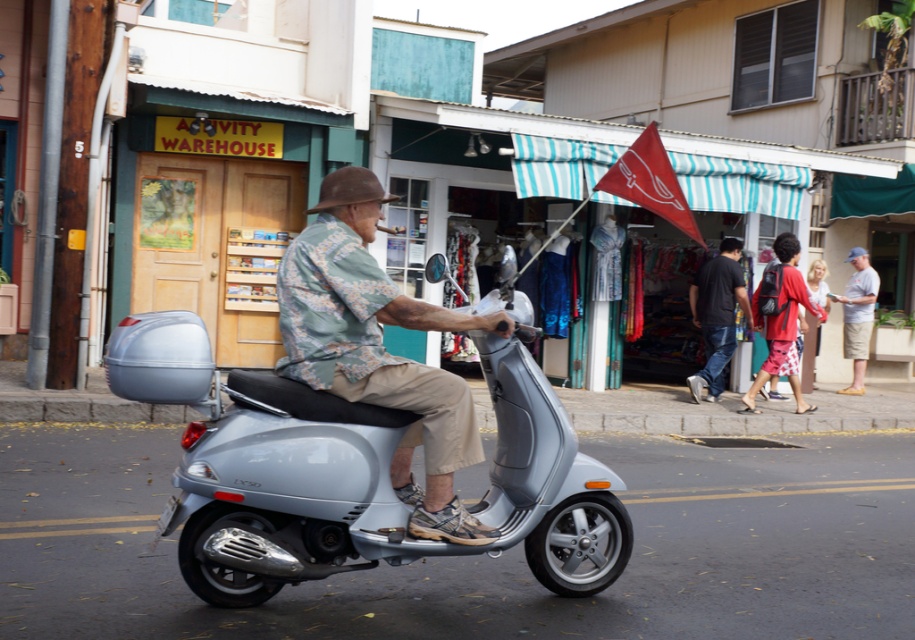
Can you confirm if reddish-pink fabric shorts at center-right is wider than light blue cotton shirt at center?

Correct, the width of reddish-pink fabric shorts at center-right exceeds that of light blue cotton shirt at center.

Looking at this image, who is positioned more to the right, reddish-pink fabric shorts at center-right or light blue cotton shirt at center?

Positioned to the right is light blue cotton shirt at center.

Who is more distant from viewer, (793, 365) or (865, 288)?

Positioned behind is point (865, 288).

In order to click on reddish-pink fabric shorts at center-right in this screenshot , I will do `click(782, 324)`.

Can you confirm if metallic silver scooter at center is wider than camouflage shirt at center?

Yes, metallic silver scooter at center is wider than camouflage shirt at center.

Between metallic silver scooter at center and camouflage shirt at center, which one appears on the right side from the viewer's perspective?

From the viewer's perspective, camouflage shirt at center appears more on the right side.

Locate an element on the screen. This screenshot has width=915, height=640. metallic silver scooter at center is located at coordinates (379, 486).

Where is `metallic silver scooter at center`? The image size is (915, 640). metallic silver scooter at center is located at coordinates (379, 486).

Which of these two, camouflage shirt at center or reddish-pink fabric shorts at center-right, stands shorter?

With less height is camouflage shirt at center.

Is point (404, 314) in front of point (752, 385)?

Yes, point (404, 314) is closer to viewer.

The height and width of the screenshot is (640, 915). Find the location of `camouflage shirt at center`. camouflage shirt at center is located at coordinates (379, 349).